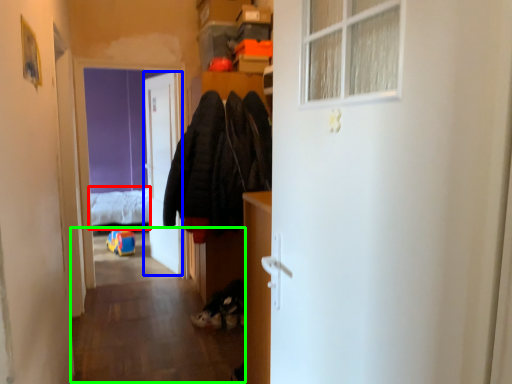
Question: Based on their relative distances, which object is farther from bed (highlighted by a red box)? Choose from door (highlighted by a blue box) and corridor (highlighted by a green box).

Choices:
 (A) door
 (B) corridor

Answer: (B)